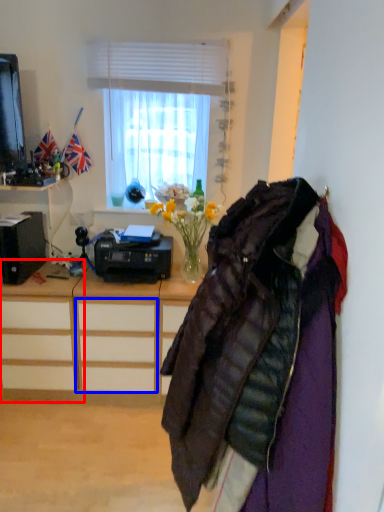
Question: Which of the following is the closest to the observer, desk (highlighted by a red box) or drawer (highlighted by a blue box)?

Choices:
 (A) desk
 (B) drawer

Answer: (B)